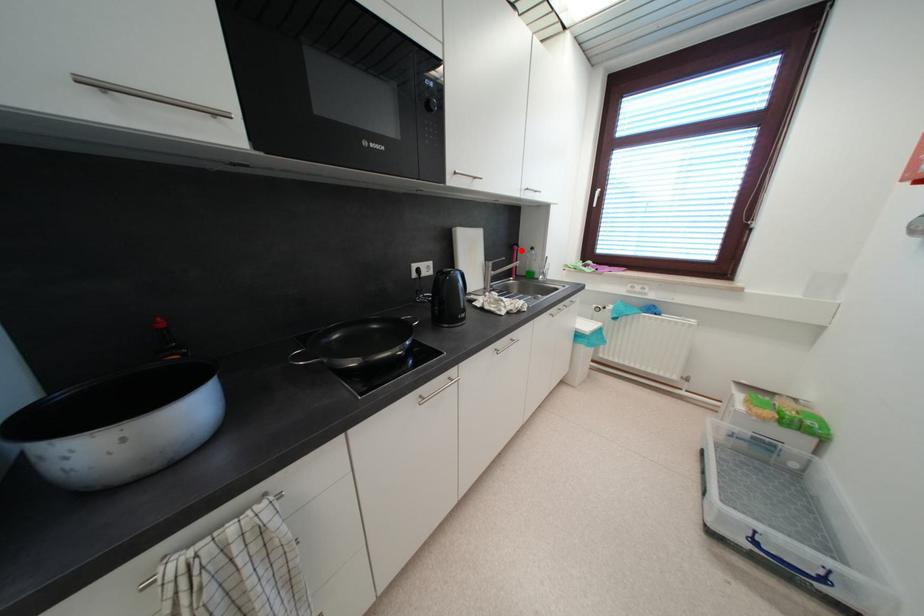
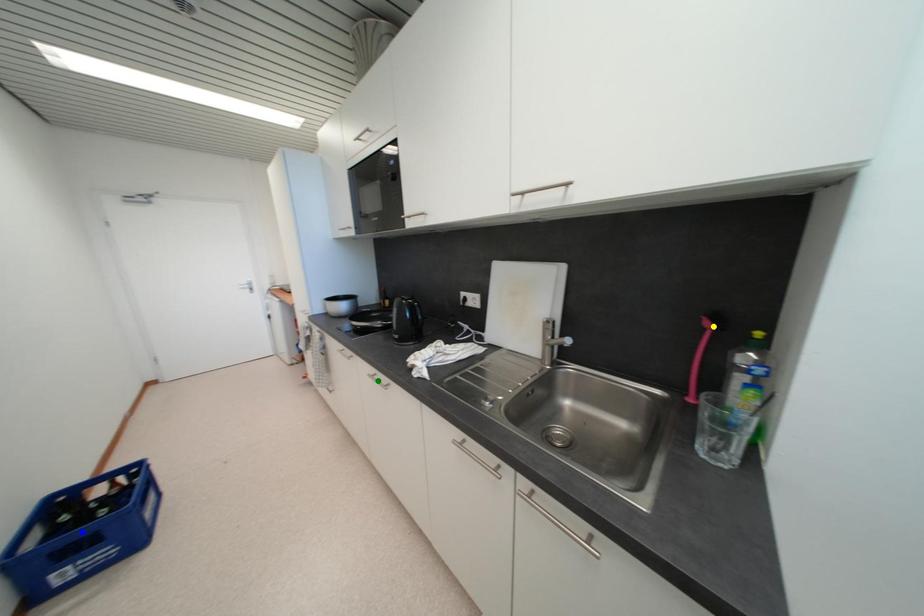
Question: I am providing you with two images of the same scene from different viewpoints. A red point is marked on the first image. You are given multiple points on the second image. Which point in image 2 is actually the same real-world point as the red point in image 1?

Choices:
 (A) blue point
 (B) yellow point
 (C) green point

Answer: (B)